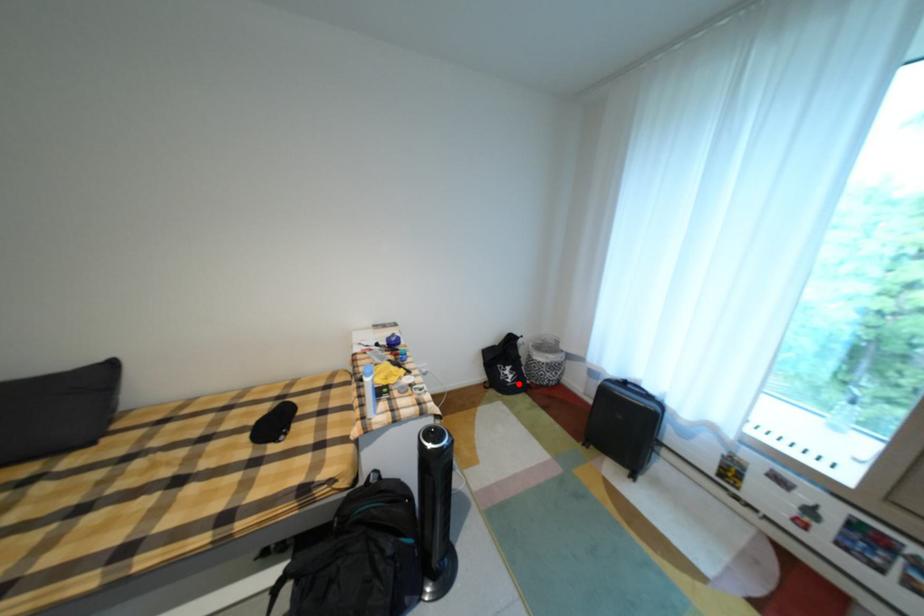
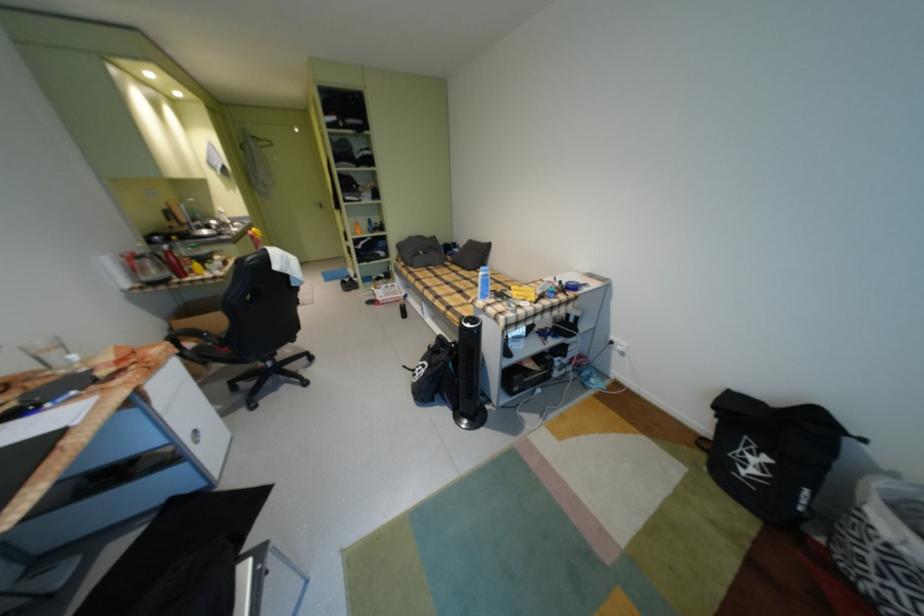
Question: I am providing you with two images of the same scene from different viewpoints. A red point is marked on the first image. Is the red point's position out of view in image 2?

Choices:
 (A) Yes
 (B) No

Answer: (B)